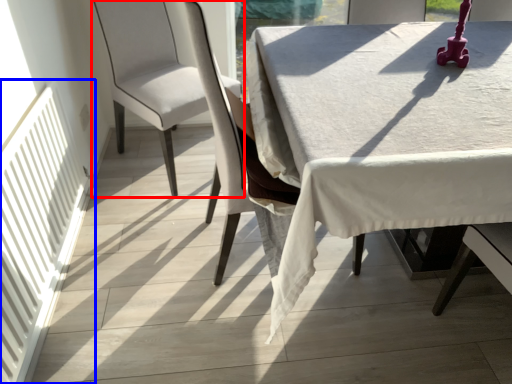
Question: Among these objects, which one is farthest to the camera, chair (highlighted by a red box) or radiator (highlighted by a blue box)?

Choices:
 (A) chair
 (B) radiator

Answer: (A)